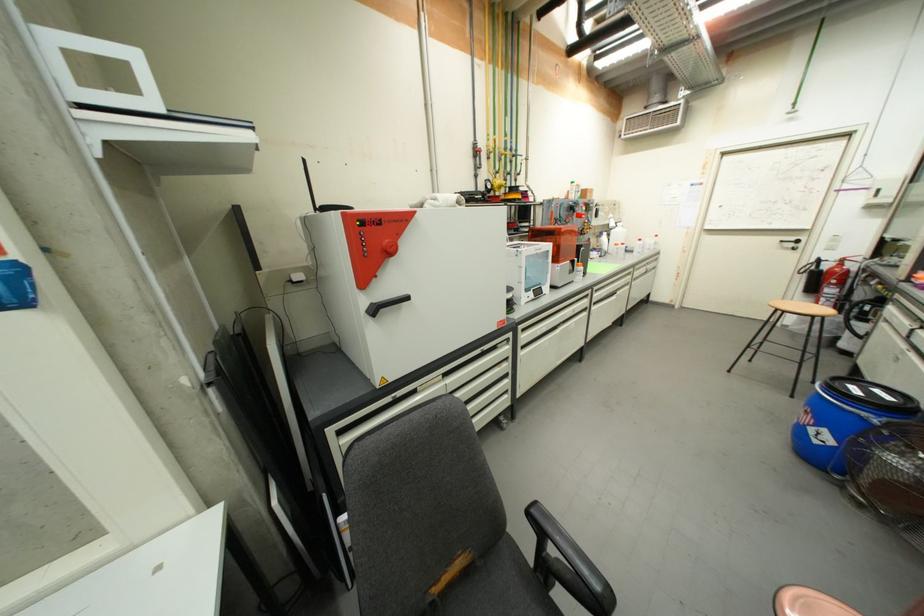
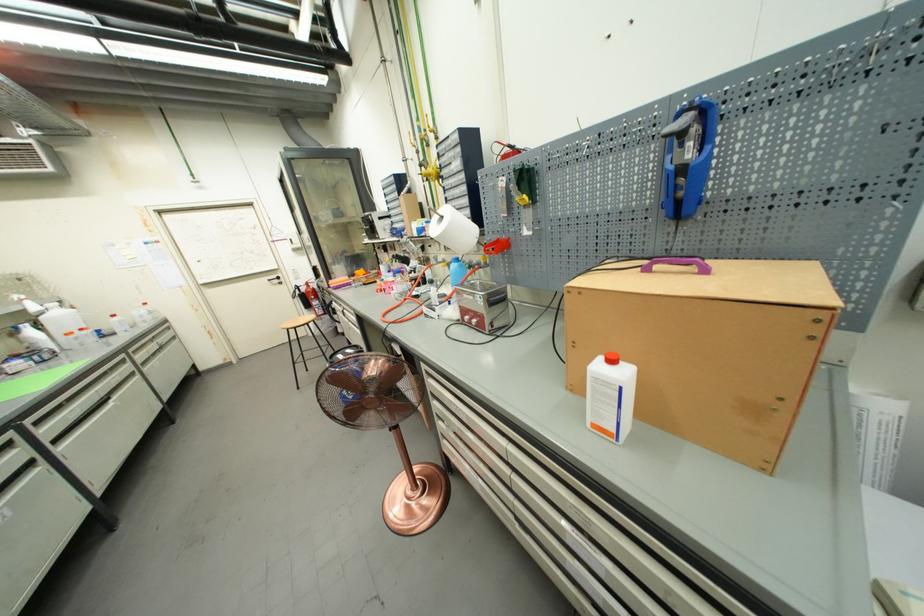
The point at (638, 280) is marked in the first image. Where is the corresponding point in the second image?

(146, 363)